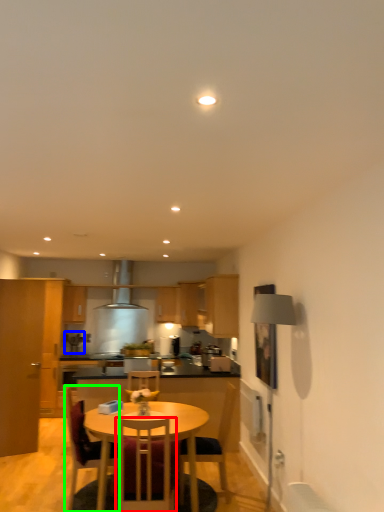
Question: Which object is positioned closest to chair (highlighted by a red box)? Select from coffee machine (highlighted by a blue box) and chair (highlighted by a green box).

Choices:
 (A) coffee machine
 (B) chair

Answer: (B)